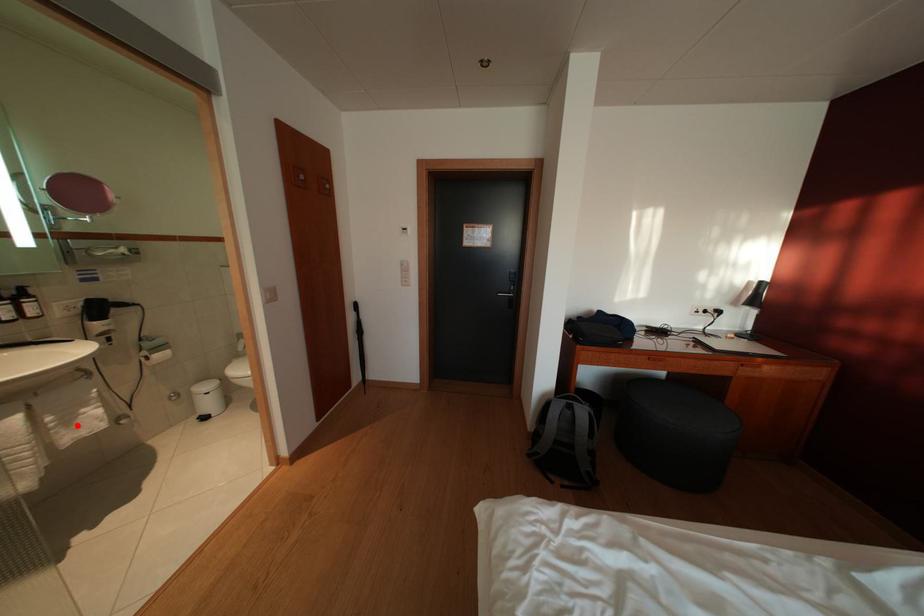
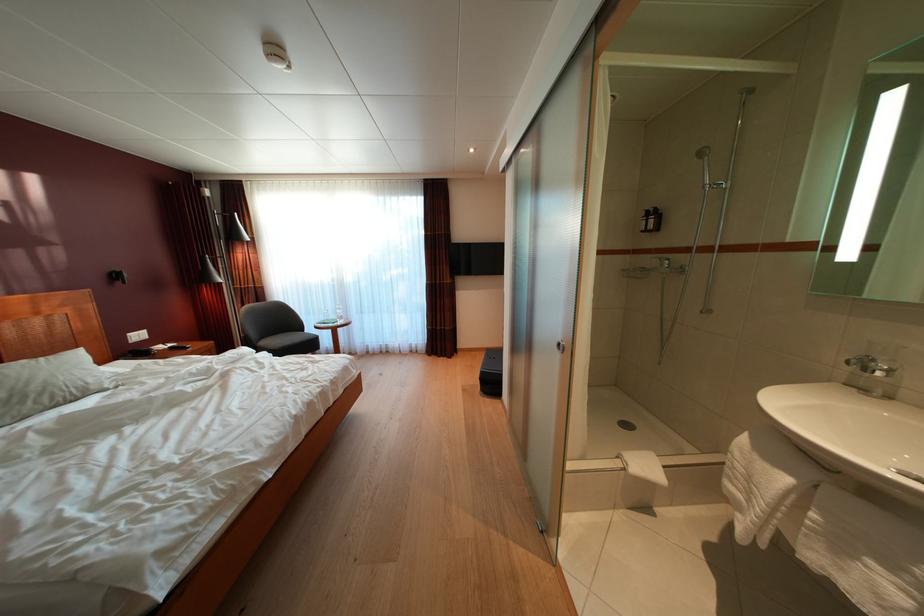
Question: A red point is marked in image1. In image2, is the corresponding 3D point closer to the camera or farther? Reply with the corresponding letter.

Choices:
 (A) The corresponding 3D point is closer.
 (B) The corresponding 3D point is farther.

Answer: (A)